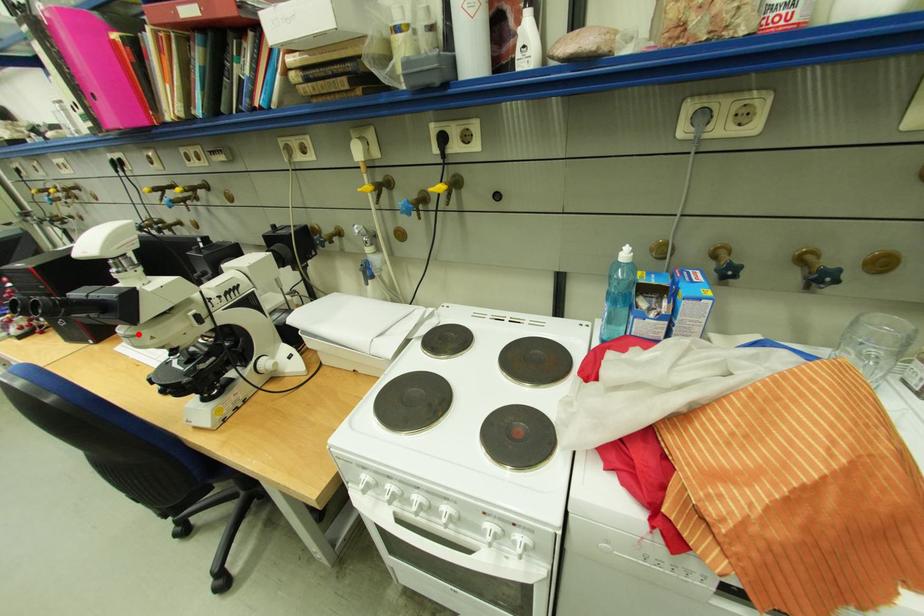
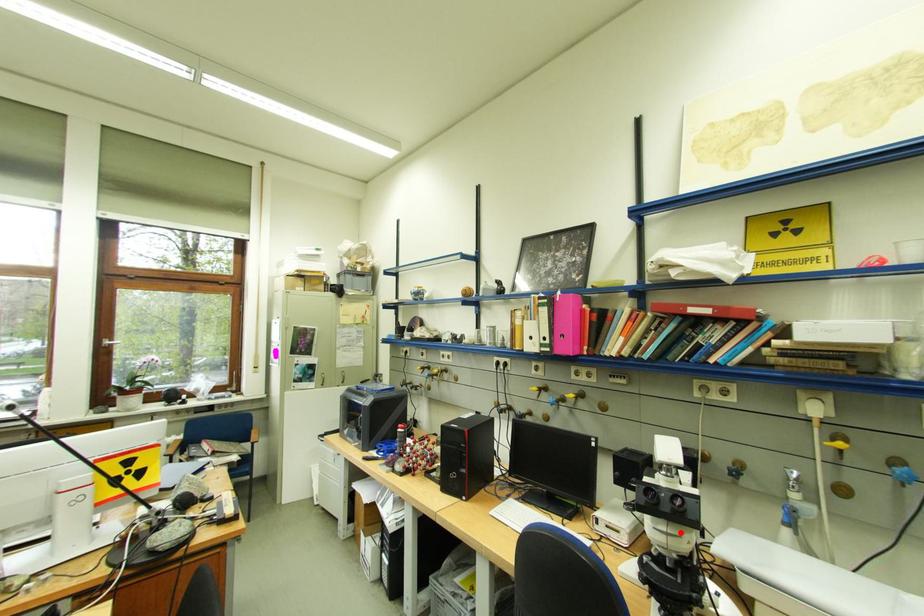
I am providing you with two images of the same scene from different viewpoints. A red point is marked on the first image and another point is marked on the second image. Do the highlighted points in image1 and image2 indicate the same real-world spot?

Yes